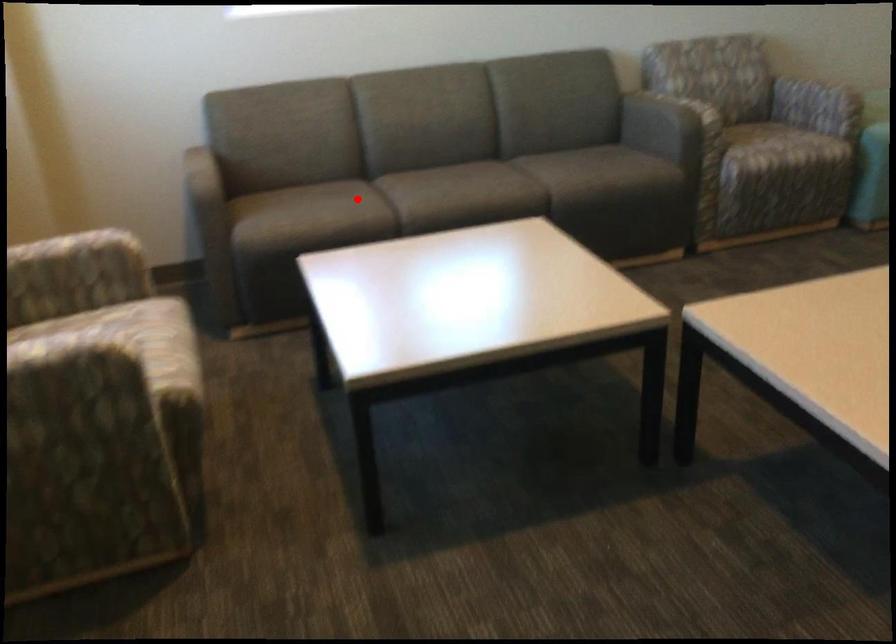
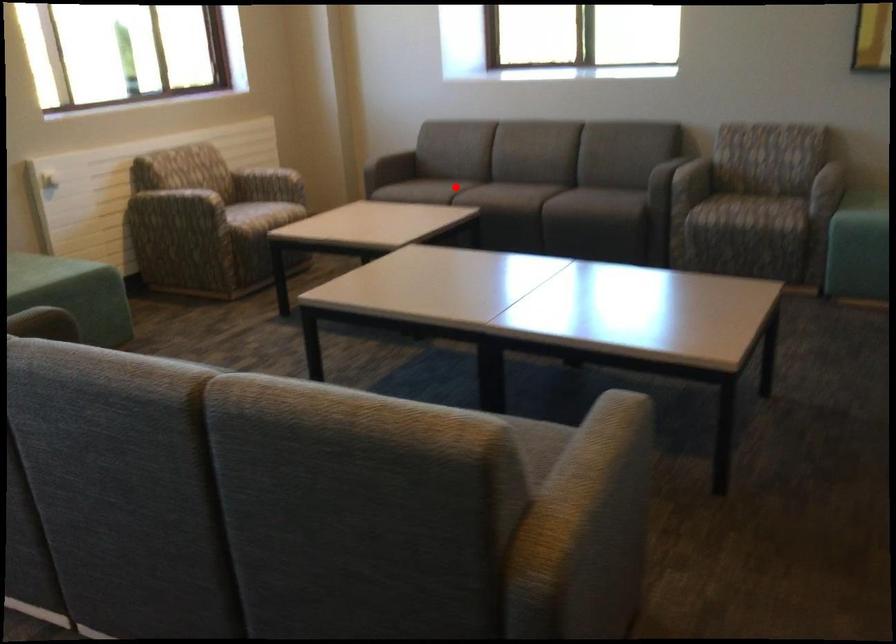
I am providing you with two images of the same scene from different viewpoints. A red point is marked on the first image and another point is marked on the second image. Is the marked point in image1 the same physical position as the marked point in image2?

Yes